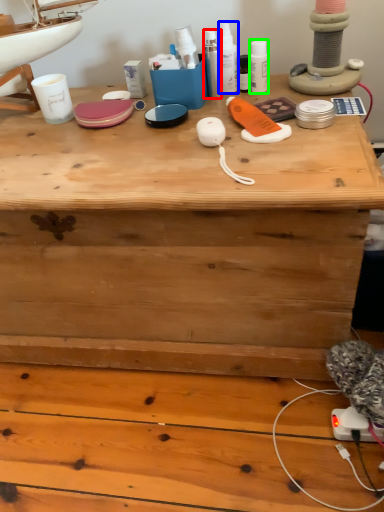
Question: Considering the real-world distances, which object is farthest from toiletry (highlighted by a red box)? toiletry (highlighted by a blue box) or toiletry (highlighted by a green box)?

Choices:
 (A) toiletry
 (B) toiletry

Answer: (B)